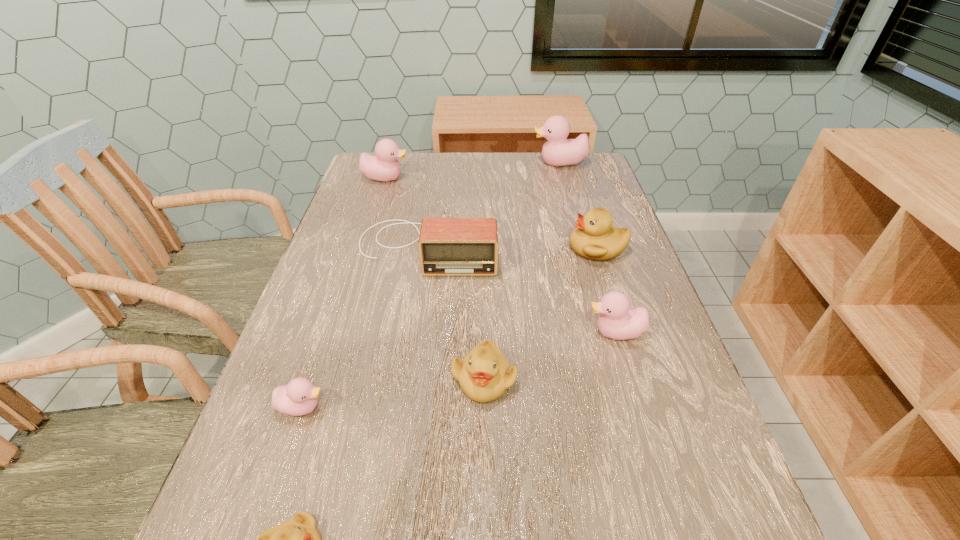
Where is `the smallest pink duckling`? the smallest pink duckling is located at coordinates (299, 397).

Identify the location of vacant space situated 0.320m on the front-facing side of the biggest pink duckling. pyautogui.click(x=434, y=163).

Where is `vacant space located 0.110m on the front-facing side of the biggest pink duckling`? vacant space located 0.110m on the front-facing side of the biggest pink duckling is located at coordinates (498, 163).

The image size is (960, 540). I want to click on free space located 0.160m on the front-facing side of the biggest pink duckling, so click(x=483, y=163).

This screenshot has height=540, width=960. I want to click on vacant region located on the front-facing side of the second biggest pink duckling, so click(x=522, y=178).

Identify the location of vacant space located 0.060m on the front-facing side of the rightmost yellow duckling. This screenshot has width=960, height=540. (545, 248).

At what (x,y) coordinates should I click in order to perform the action: click on vacant space located on the front-facing side of the rightmost yellow duckling. Please return your answer as a coordinate pair (x, y). Looking at the image, I should click on (425, 248).

This screenshot has height=540, width=960. I want to click on blank area located 0.060m on the front-facing side of the rightmost yellow duckling, so click(x=545, y=248).

At what (x,y) coordinates should I click in order to perform the action: click on blank space located on the front-facing side of the radio receiver. Please return your answer as a coordinate pair (x, y). This screenshot has width=960, height=540. Looking at the image, I should click on (402, 417).

Where is `vacant region located 0.330m on the front-facing side of the third biggest pink duckling`? vacant region located 0.330m on the front-facing side of the third biggest pink duckling is located at coordinates (425, 333).